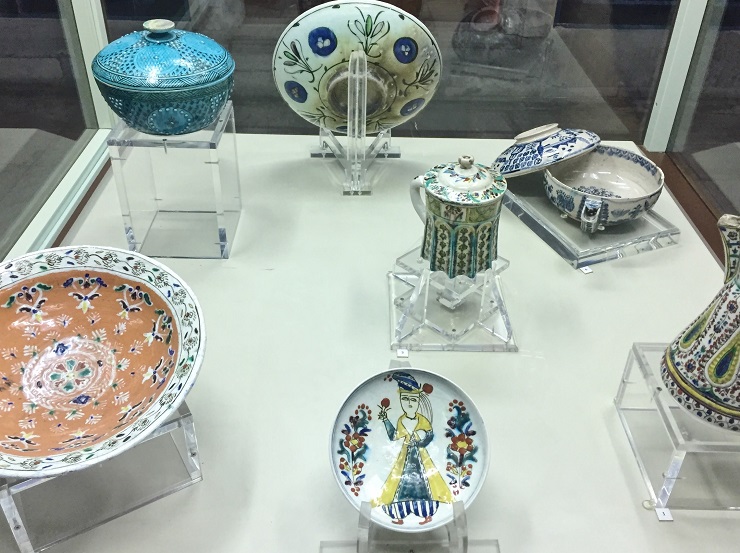
Locate an element on the screen. The image size is (740, 553). cup is located at coordinates (474, 236).